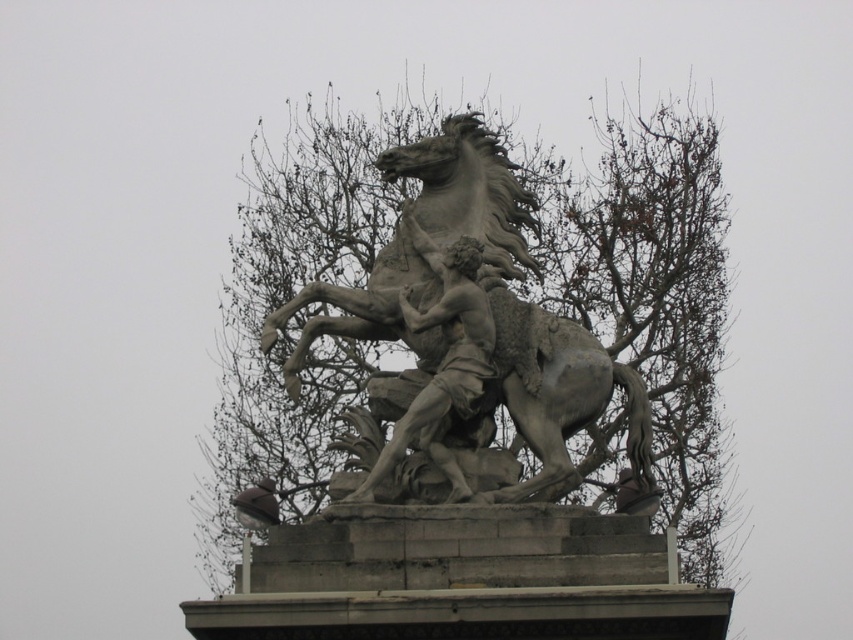
Question: Does bare branches at upper center have a larger size compared to smooth gray statue at center?

Choices:
 (A) no
 (B) yes

Answer: (B)

Question: Is bare branches at upper center further to camera compared to smooth gray statue at center?

Choices:
 (A) yes
 (B) no

Answer: (B)

Question: Among these objects, which one is farthest from the camera?

Choices:
 (A) gray stone horse at center
 (B) smooth gray statue at center

Answer: (A)

Question: Considering the real-world distances, which object is closest to the smooth gray statue at center?

Choices:
 (A) bare branches at upper center
 (B) gray stone horse at center

Answer: (B)

Question: Which of the following is the farthest from the observer?

Choices:
 (A) gray stone horse at center
 (B) smooth gray statue at center
 (C) bare branches at upper center

Answer: (A)

Question: Does gray stone horse at center have a larger size compared to smooth gray statue at center?

Choices:
 (A) no
 (B) yes

Answer: (B)